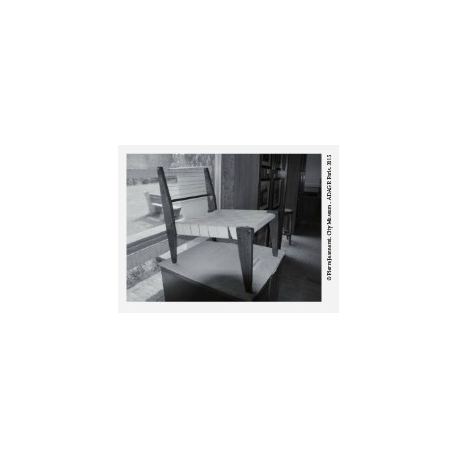
Locate an element on the screen. This screenshot has height=458, width=458. table bottom is located at coordinates (193, 297).